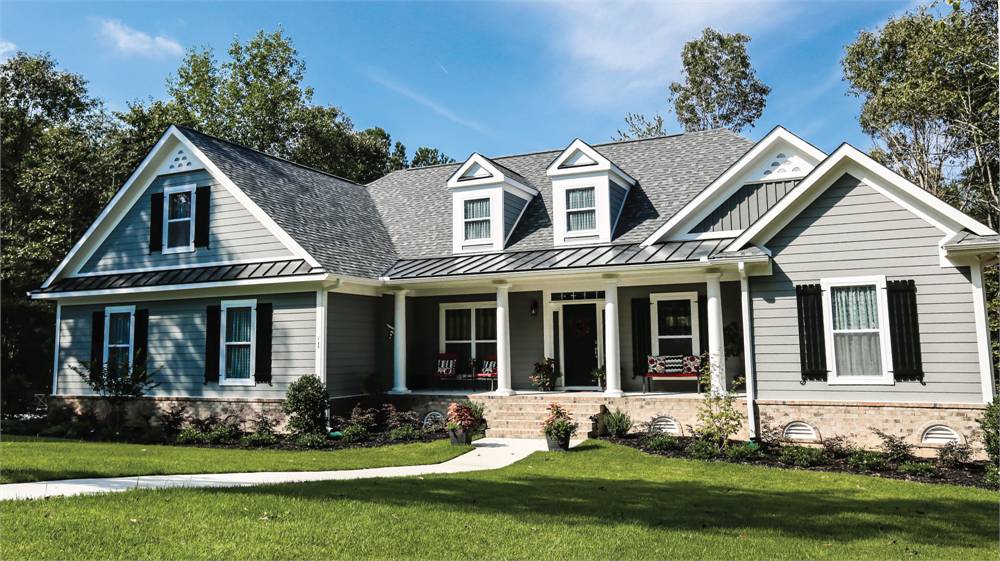
The image size is (1000, 561). Find the location of `window`. window is located at coordinates (845, 340), (668, 338), (468, 340), (576, 214), (476, 217), (179, 229), (242, 360), (125, 350).